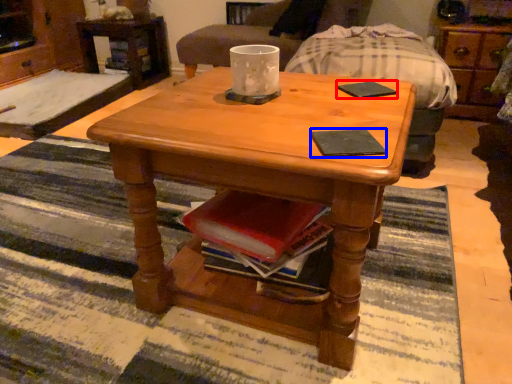
Question: Among these objects, which one is nearest to the camera, pad (highlighted by a red box) or pad (highlighted by a blue box)?

Choices:
 (A) pad
 (B) pad

Answer: (B)